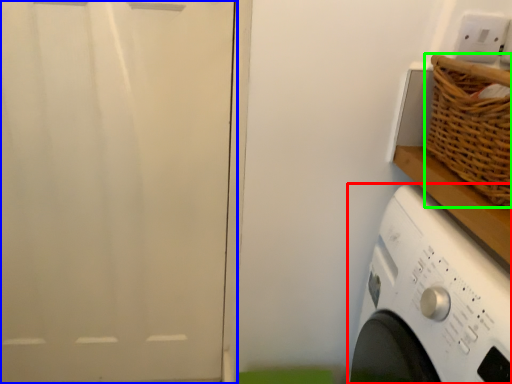
Question: Based on their relative distances, which object is farther from washing machine (highlighted by a red box)? Choose from screen door (highlighted by a blue box) and basket (highlighted by a green box).

Choices:
 (A) screen door
 (B) basket

Answer: (A)